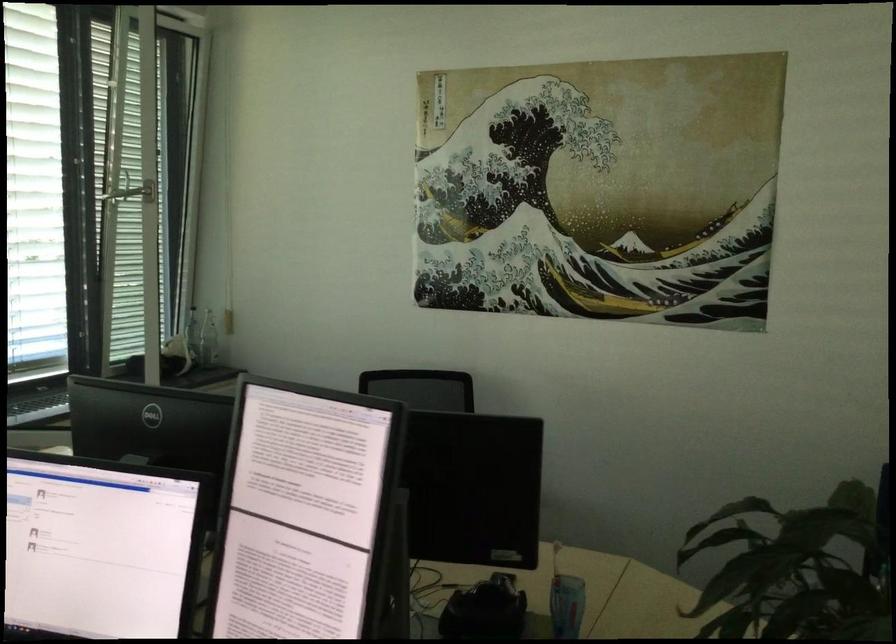
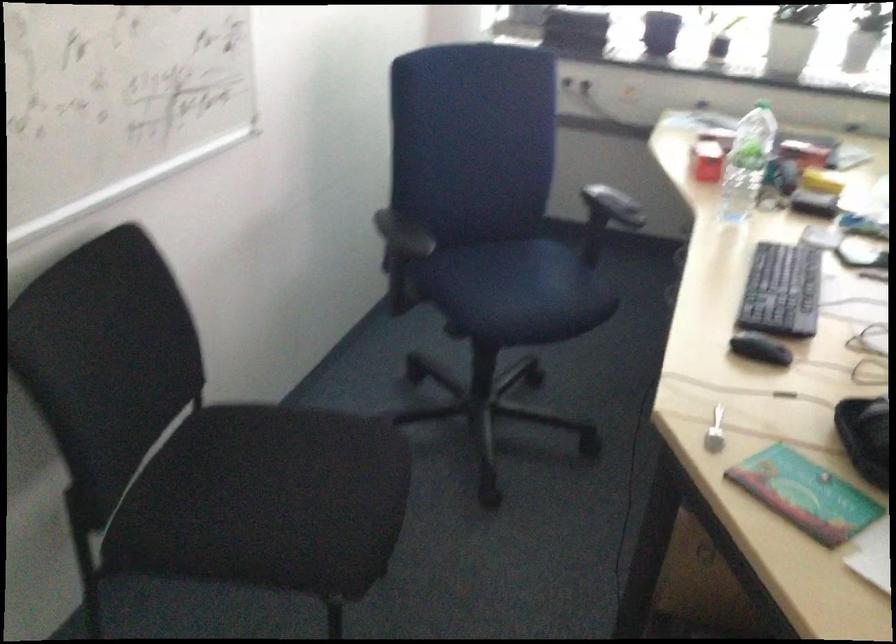
How did the camera likely rotate?

The camera rotated toward left-down.